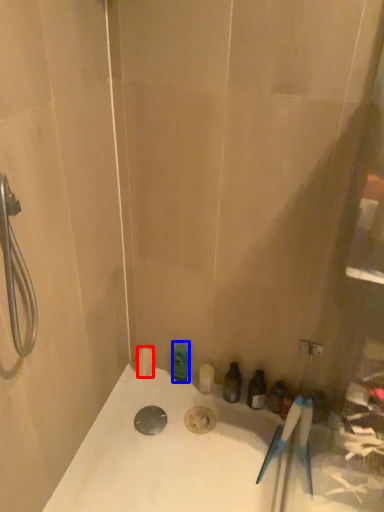
Question: Among these objects, which one is farthest to the camera, toiletry (highlighted by a red box) or toiletry (highlighted by a blue box)?

Choices:
 (A) toiletry
 (B) toiletry

Answer: (A)